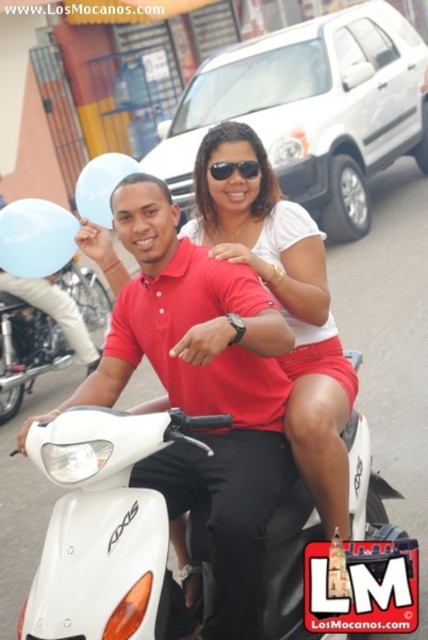
Describe the element at coordinates (201, 390) in the screenshot. I see `matte red polo shirt at center` at that location.

Does matte red polo shirt at center have a lesser height compared to white glossy motorcycle at left?

No, matte red polo shirt at center is not shorter than white glossy motorcycle at left.

This screenshot has width=428, height=640. What are the coordinates of `matte red polo shirt at center` in the screenshot? It's located at (201, 390).

Can you confirm if matte red polo shirt at center is shorter than light blue rubber balloon at upper left?

In fact, matte red polo shirt at center may be taller than light blue rubber balloon at upper left.

Does matte red polo shirt at center have a smaller size compared to light blue rubber balloon at upper left?

No, matte red polo shirt at center is not smaller than light blue rubber balloon at upper left.

What do you see at coordinates (201, 390) in the screenshot? This screenshot has width=428, height=640. I see `matte red polo shirt at center` at bounding box center [201, 390].

Where is `matte red polo shirt at center`? Image resolution: width=428 pixels, height=640 pixels. matte red polo shirt at center is located at coordinates (201, 390).

Measure the distance between light blue rubber balloon at upper left and camera.

light blue rubber balloon at upper left and camera are 9.35 feet apart.

Does light blue rubber balloon at upper left appear over transparent blue balloon at upper left?

Incorrect, light blue rubber balloon at upper left is not positioned above transparent blue balloon at upper left.

Find the location of a particular element. The height and width of the screenshot is (640, 428). light blue rubber balloon at upper left is located at coordinates (35, 237).